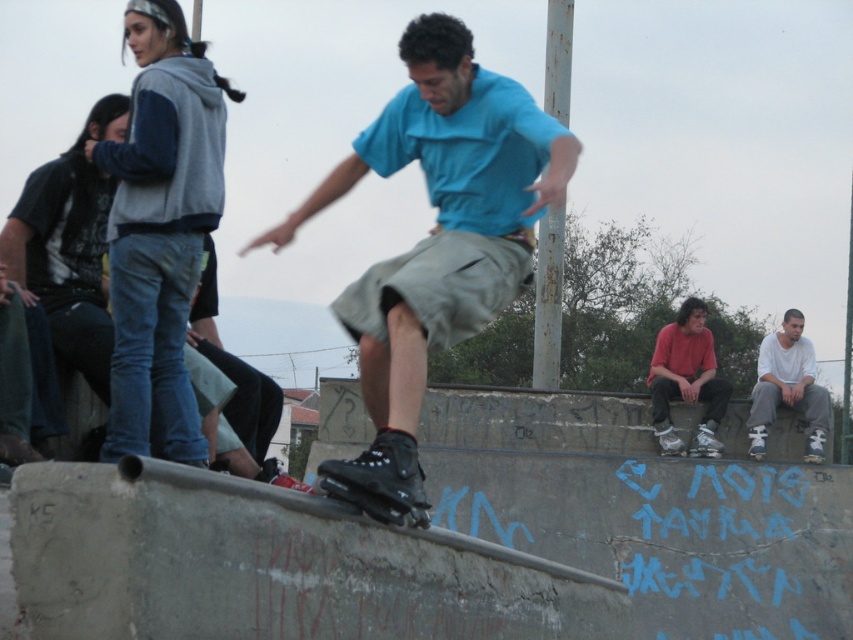
Question: Is white matte shirt at lower right wider than black matte skateboard at center?

Choices:
 (A) yes
 (B) no

Answer: (A)

Question: Is white matte shirt at lower right to the left of black matte skateboard at center from the viewer's perspective?

Choices:
 (A) no
 (B) yes

Answer: (A)

Question: Where is red matte shirt at center located in relation to white matte shirt at lower right in the image?

Choices:
 (A) below
 (B) above

Answer: (B)

Question: Which point appears farthest from the camera in this image?

Choices:
 (A) (747, 416)
 (B) (704, 308)
 (C) (451, 209)

Answer: (B)

Question: Which is nearer to the white matte shirt at lower right?

Choices:
 (A) black matte skateboard at center
 (B) matte blue shirt at center

Answer: (B)

Question: Which of the following is the farthest from the observer?

Choices:
 (A) matte blue shirt at center
 (B) white matte shirt at lower right
 (C) red matte shirt at center
 (D) black matte skateboard at center

Answer: (B)